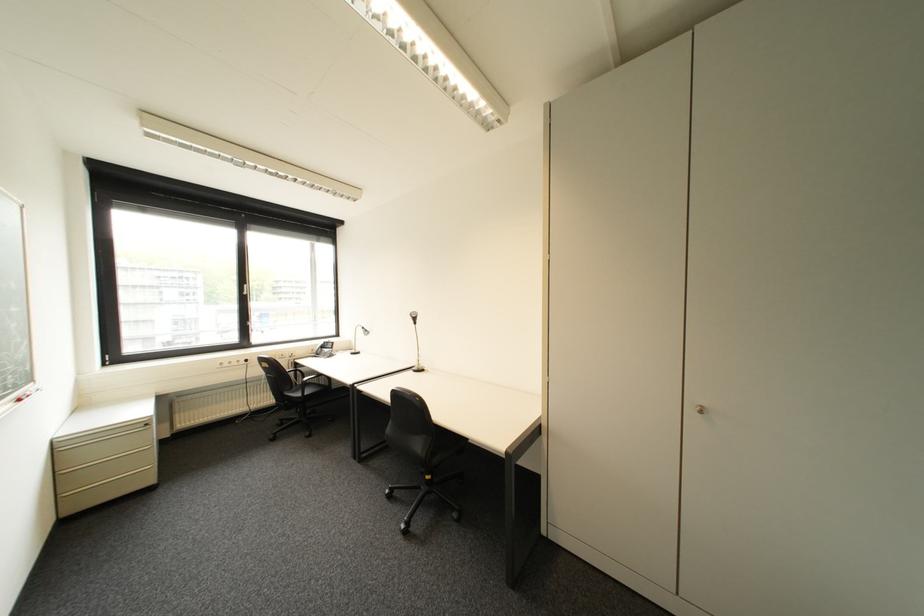
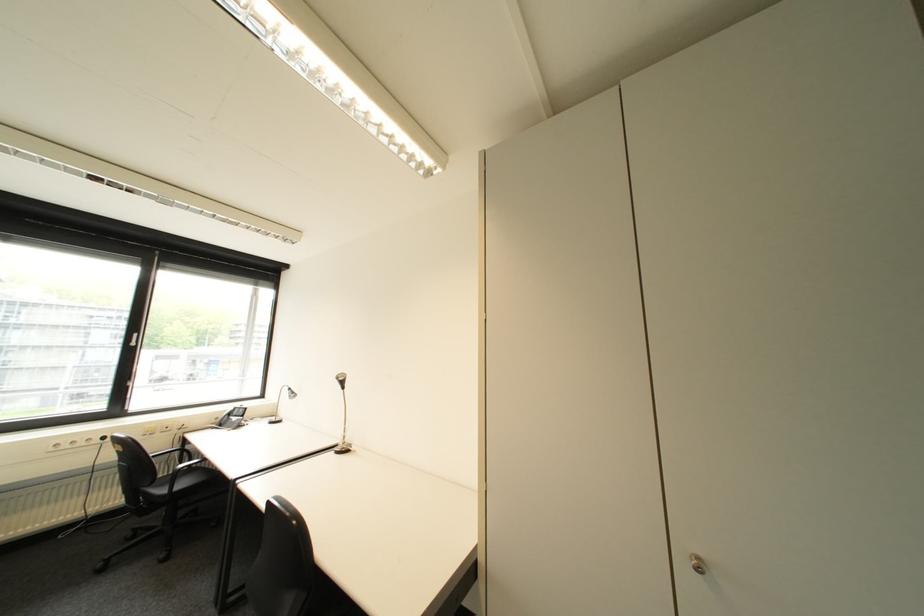
The point at (257, 361) is marked in the first image. Where is the corresponding point in the second image?

(114, 439)